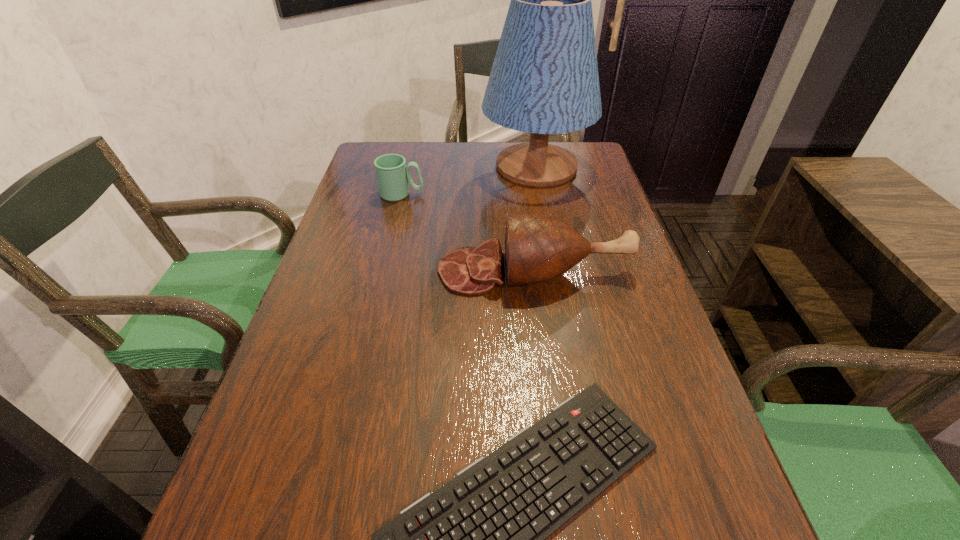
This screenshot has height=540, width=960. In order to click on unoccupied position between the leftmost object and the lampshade in this screenshot , I will do `click(468, 180)`.

The height and width of the screenshot is (540, 960). In order to click on the closest object to the lampshade in this screenshot , I will do `click(393, 176)`.

You are a GUI agent. You are given a task and a screenshot of the screen. Output one action in this format:
    pyautogui.click(x=<x>, y=<y>)
    Task: Click on the object that stands as the closest to the tallest object
    The image size is (960, 540).
    Given the screenshot: What is the action you would take?
    pyautogui.click(x=393, y=176)

Find the location of a particular element. free space in the image that satisfies the following two spatial constraints: 1. on the front side of the tallest object; 2. on the side of the mug with the handle is located at coordinates pos(540,194).